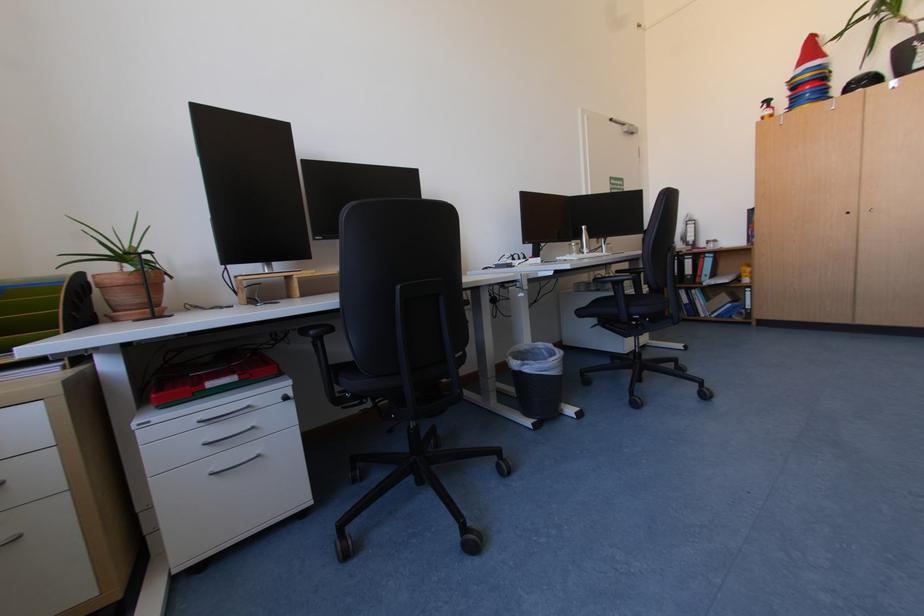
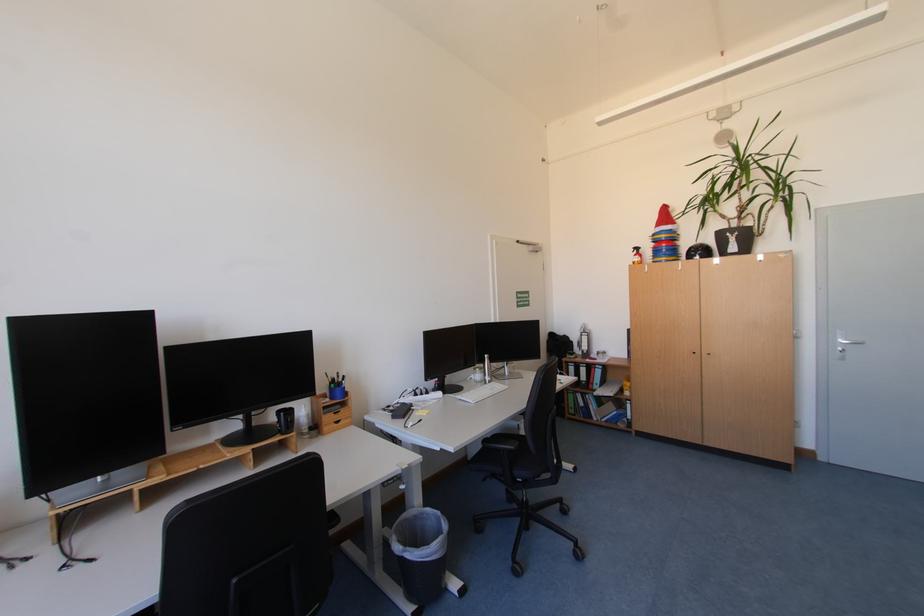
Find the pixel in the second image that matches (x=697, y=262) in the first image.

(590, 371)